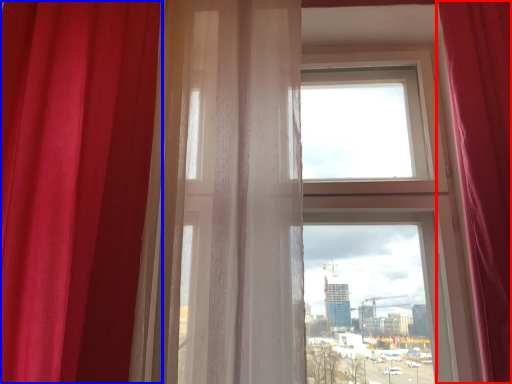
Question: Which of the following is the closest to the observer, curtain (highlighted by a red box) or curtain (highlighted by a blue box)?

Choices:
 (A) curtain
 (B) curtain

Answer: (A)